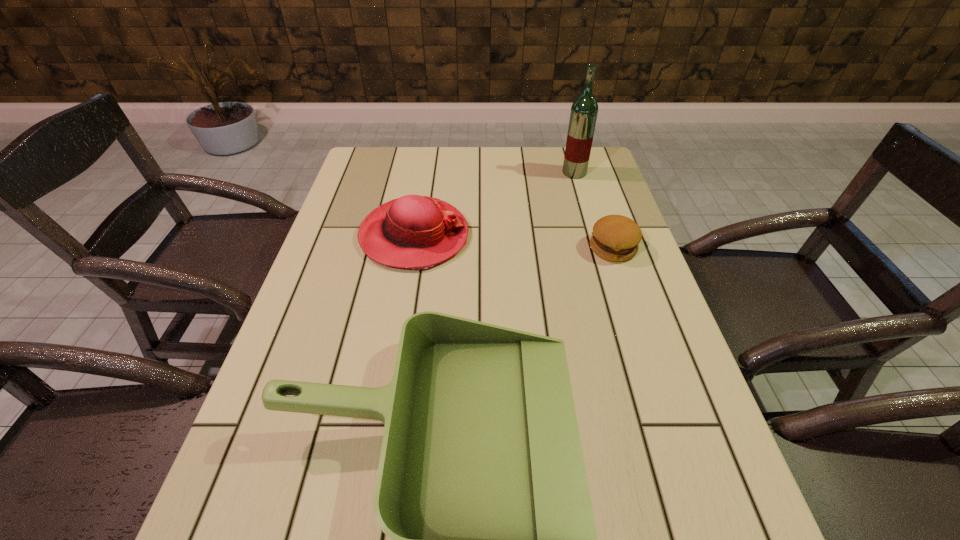
Find the location of a particular element. The image size is (960, 540). hamburger located in the right edge section of the desktop is located at coordinates (615, 238).

At what (x,y) coordinates should I click in order to perform the action: click on object situated at the far right corner. Please return your answer as a coordinate pair (x, y). Looking at the image, I should click on (584, 110).

In order to click on vacant space at the far edge of the desktop in this screenshot , I will do `click(551, 160)`.

This screenshot has height=540, width=960. Identify the location of free spot at the left edge of the desktop. (316, 307).

The image size is (960, 540). In the image, there is a desktop. What are the coordinates of `free space at the right edge` in the screenshot? It's located at (604, 297).

The image size is (960, 540). In order to click on vacant area that lies between the tallest object and the hat in this screenshot , I will do `click(494, 204)`.

This screenshot has height=540, width=960. What are the coordinates of `vacant region between the hat and the farthest object` in the screenshot? It's located at (494, 204).

The image size is (960, 540). Identify the location of free space between the hamburger and the tallest object. pos(593,211).

Image resolution: width=960 pixels, height=540 pixels. Find the location of `vacant area that lies between the farthest object and the shortest object`. vacant area that lies between the farthest object and the shortest object is located at coordinates (593, 211).

Locate which object is the closest to the nearest object. Please provide its 2D coordinates. Your answer should be formatted as a tuple, i.e. [(x, y)], where the tuple contains the x and y coordinates of a point satisfying the conditions above.

[(417, 232)]